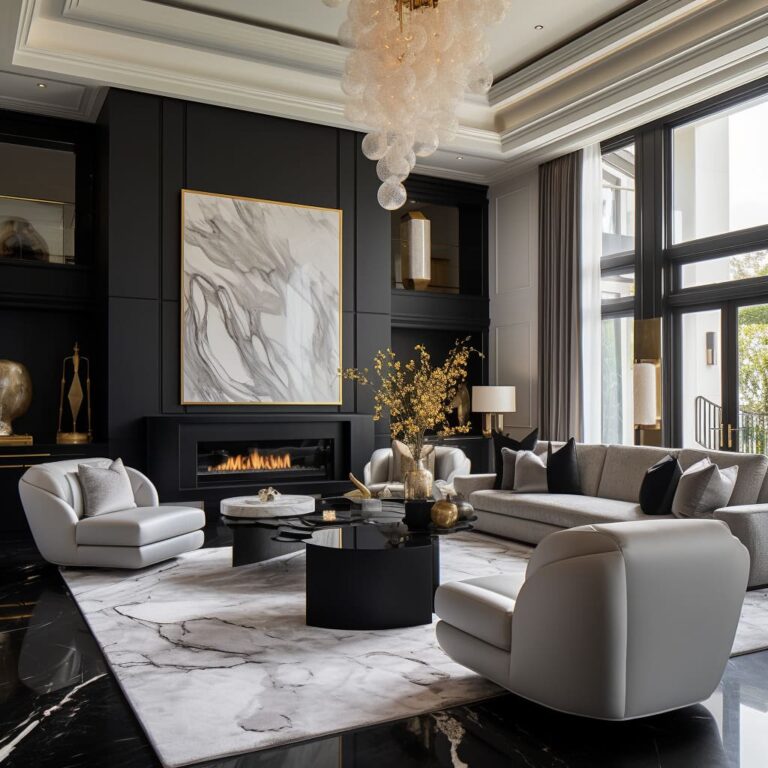
Locate an element on the screen. doors is located at coordinates pos(710,366), pos(750,361).